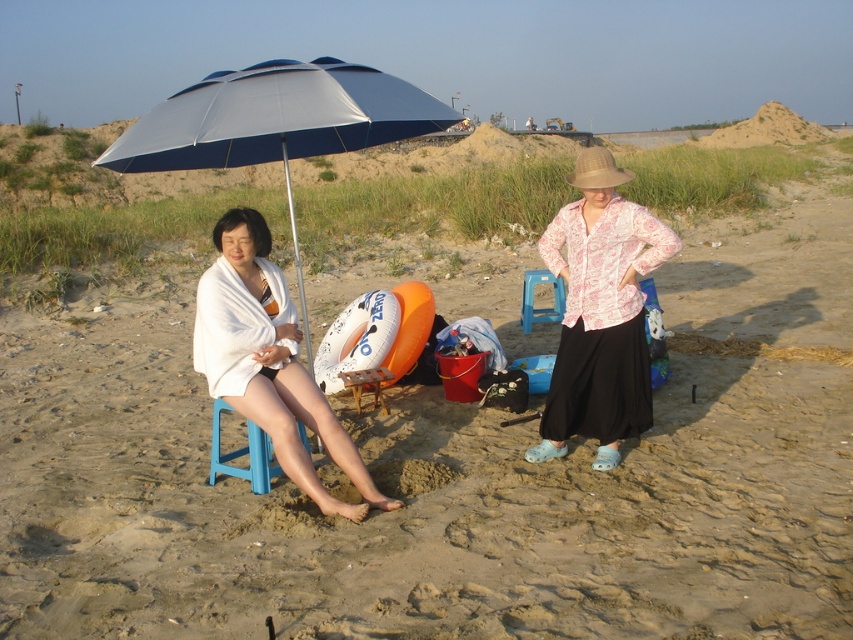
Question: Does white towel at left appear on the right side of blue plastic stool at lower left?

Choices:
 (A) no
 (B) yes

Answer: (B)

Question: Estimate the real-world distances between objects in this image. Which object is farther from the white towel at left?

Choices:
 (A) blue plastic stool at lower left
 (B) blue fabric umbrella at upper left
 (C) pink floral blouse at center

Answer: (B)

Question: Which is farther from the blue plastic beach chair at center?

Choices:
 (A) pink floral blouse at center
 (B) white towel at left
 (C) blue plastic stool at lower left
 (D) blue fabric umbrella at upper left

Answer: (D)

Question: Does pink floral blouse at center appear on the left side of blue plastic stool at lower left?

Choices:
 (A) yes
 (B) no

Answer: (B)

Question: Is white towel at left above blue plastic stool at lower left?

Choices:
 (A) no
 (B) yes

Answer: (B)

Question: Among these points, which one is farthest from the camera?

Choices:
 (A) 250,413
 (B) 621,420
 (C) 532,276

Answer: (C)